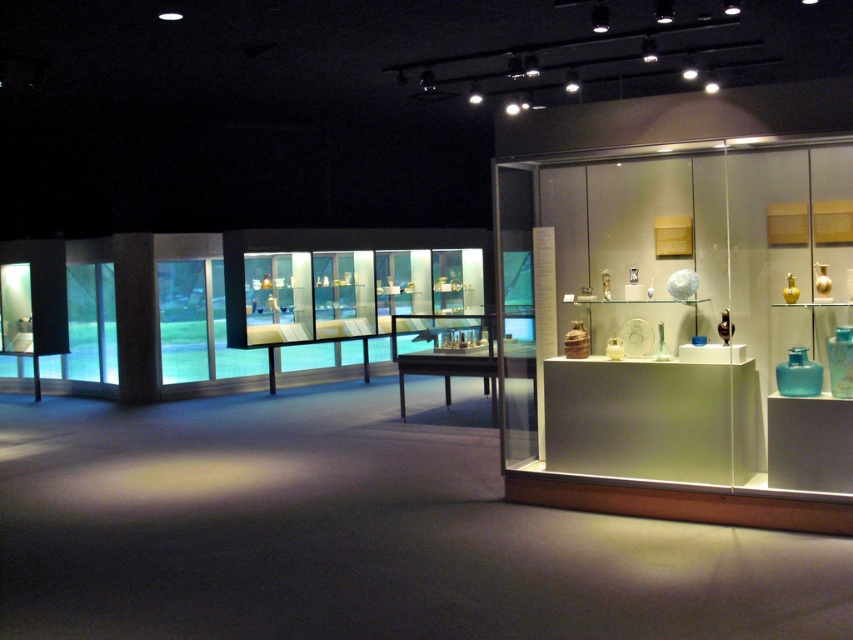
Question: Which of these objects is positioned farthest from the transparent glass vase at right?

Choices:
 (A) teal glass vase at center
 (B) translucent glass display case at right

Answer: (B)

Question: Estimate the real-world distances between objects in this image. Which object is closer to the transparent glass vase at right?

Choices:
 (A) translucent glass display case at right
 (B) teal glass vase at center

Answer: (B)

Question: Is translucent glass display case at right above transparent glass vase at right?

Choices:
 (A) yes
 (B) no

Answer: (A)

Question: Which of the following is the farthest from the observer?

Choices:
 (A) translucent glass display case at right
 (B) transparent glass vase at right

Answer: (B)

Question: Does translucent glass display case at right have a larger size compared to teal glass vase at center?

Choices:
 (A) no
 (B) yes

Answer: (B)

Question: Is transparent glass vase at right to the left of teal glass vase at center from the viewer's perspective?

Choices:
 (A) yes
 (B) no

Answer: (A)